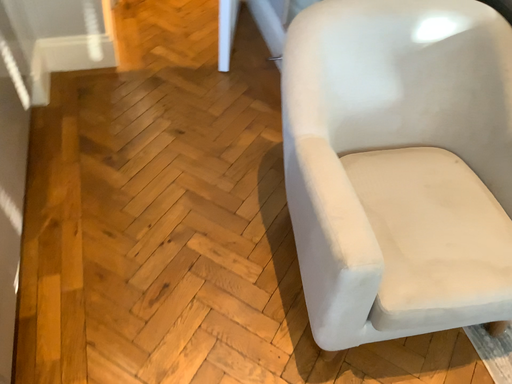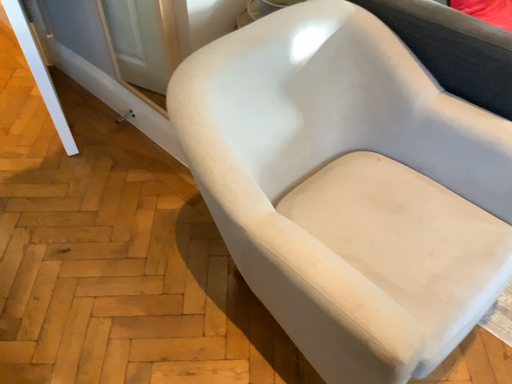
Question: Which way did the camera rotate in the video?

Choices:
 (A) rotated left
 (B) rotated right

Answer: (B)